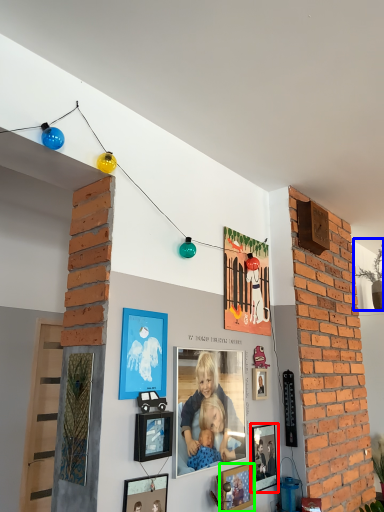
Question: Which object is positioned closest to picture frame (highlighted by a red box)? Select from plant (highlighted by a blue box) and picture frame (highlighted by a green box).

Choices:
 (A) plant
 (B) picture frame

Answer: (B)